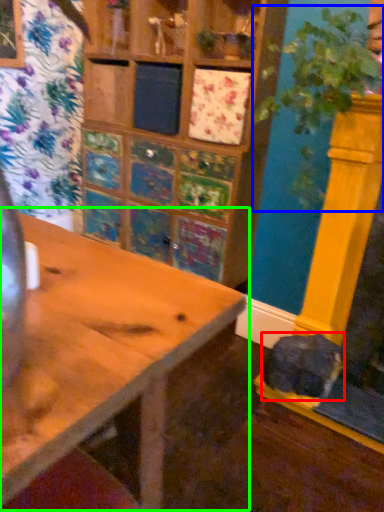
Question: Estimate the real-world distances between objects in this image. Which object is closer to animal (highlighted by a red box), plant (highlighted by a blue box) or table (highlighted by a green box)?

Choices:
 (A) plant
 (B) table

Answer: (A)